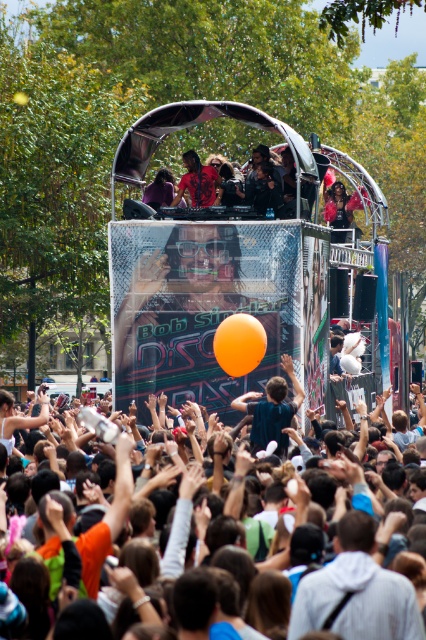
Question: Which of the following is the farthest from the observer?

Choices:
 (A) matte orange balloon at center
 (B) orange rubber balloon at center

Answer: (B)

Question: Among these objects, which one is farthest from the camera?

Choices:
 (A) transparent glass decker bus at center
 (B) orange rubber balloon at center
 (C) matte orange balloon at center

Answer: (A)

Question: Is matte orange balloon at center in front of orange rubber balloon at center?

Choices:
 (A) no
 (B) yes

Answer: (B)

Question: Which of the following is the closest to the observer?

Choices:
 (A) dark blue shirt at center
 (B) orange rubber balloon at center
 (C) shiny red shirt at center
 (D) transparent glass decker bus at center

Answer: (A)

Question: Does transparent glass decker bus at center come in front of shiny red shirt at center?

Choices:
 (A) yes
 (B) no

Answer: (A)

Question: Does transparent glass decker bus at center have a lesser width compared to matte orange balloon at center?

Choices:
 (A) yes
 (B) no

Answer: (B)